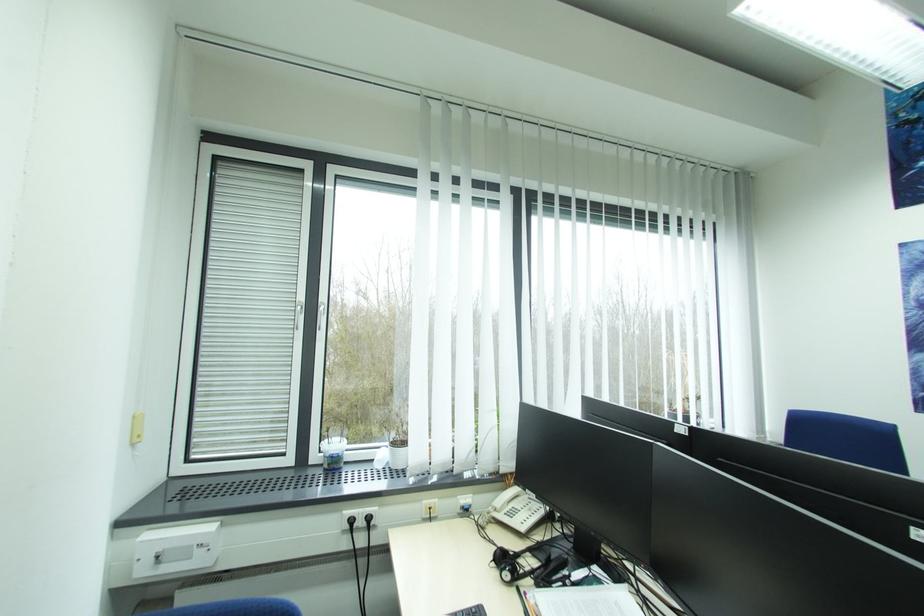
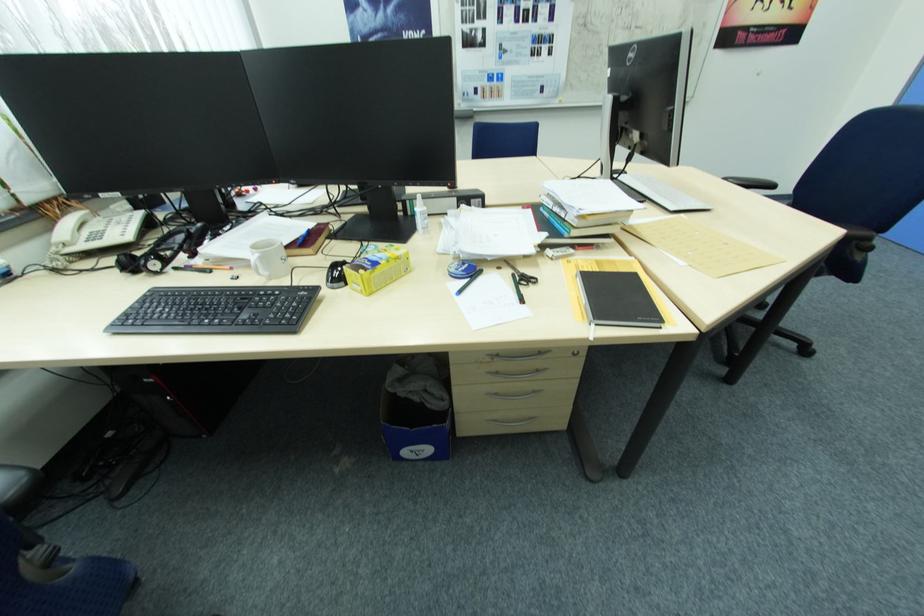
The images are taken continuously from a first-person perspective. In which direction is your viewpoint rotating?

The camera's rotation is toward right-down.